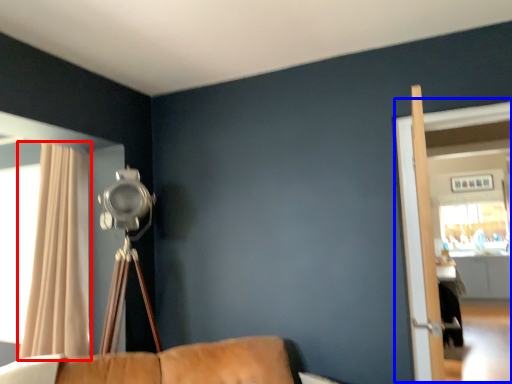
Question: Which point is further to the camera, curtain (highlighted by a red box) or screen door (highlighted by a blue box)?

Choices:
 (A) curtain
 (B) screen door

Answer: (A)